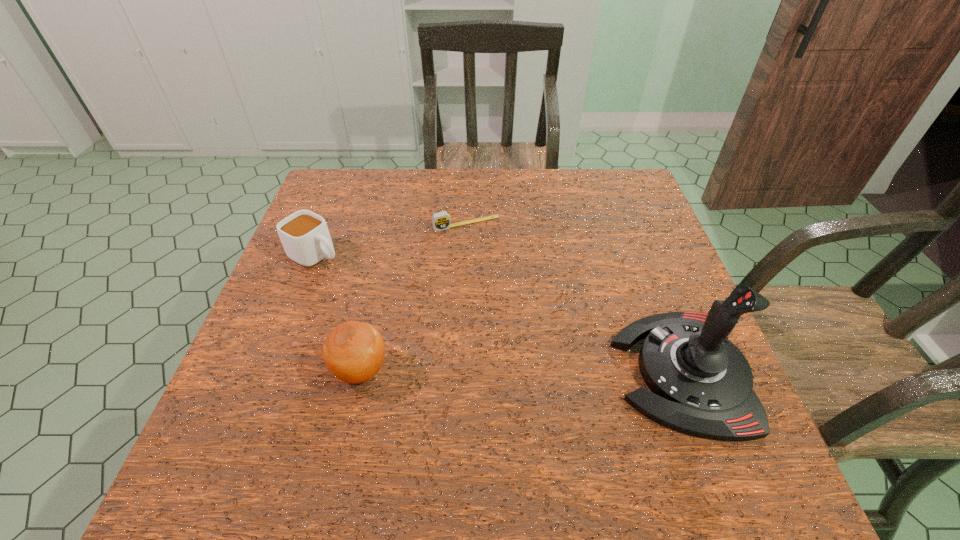
Identify the location of vacant space in between the tape measure and the tallest object. The height and width of the screenshot is (540, 960). (574, 298).

I want to click on unoccupied area between the second tallest object and the shortest object, so point(414,297).

Locate an element on the screen. This screenshot has width=960, height=540. vacant point located between the tallest object and the second farthest object is located at coordinates (499, 313).

The image size is (960, 540). In order to click on empty space that is in between the second object from left to right and the rightmost object in this screenshot , I will do `click(521, 372)`.

At what (x,y) coordinates should I click in order to perform the action: click on free space that is in between the third tallest object and the third object from right to left. Please return your answer as a coordinate pair (x, y). The width and height of the screenshot is (960, 540). Looking at the image, I should click on (339, 312).

Where is `free area in between the cup and the tallest object`? This screenshot has height=540, width=960. free area in between the cup and the tallest object is located at coordinates coord(499,313).

Where is `blank region between the orange and the leftmost object`? This screenshot has width=960, height=540. blank region between the orange and the leftmost object is located at coordinates (339, 312).

Identify the location of vacant area that lies between the orange and the shortest object. This screenshot has width=960, height=540. (414, 297).

At what (x,y) coordinates should I click in order to perform the action: click on empty space between the second farthest object and the rightmost object. Please return your answer as a coordinate pair (x, y). Image resolution: width=960 pixels, height=540 pixels. Looking at the image, I should click on 499,313.

Select which object appears as the third closest to the third object from left to right. Please provide its 2D coordinates. Your answer should be formatted as a tuple, i.e. [(x, y)], where the tuple contains the x and y coordinates of a point satisfying the conditions above.

[(354, 351)]